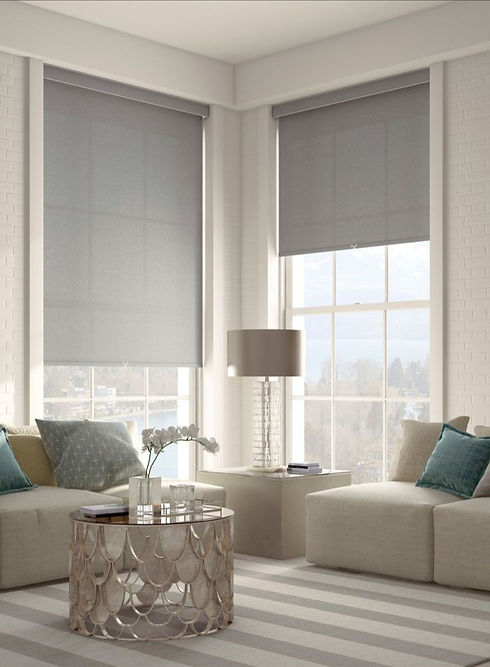
This screenshot has width=490, height=667. What are the coordinates of `shades` in the screenshot? It's located at (349, 213), (107, 340).